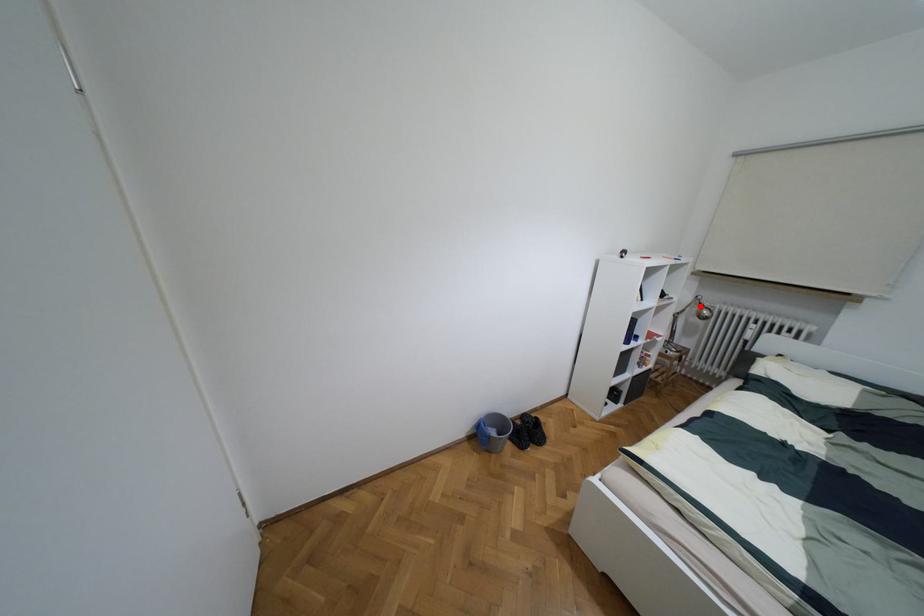
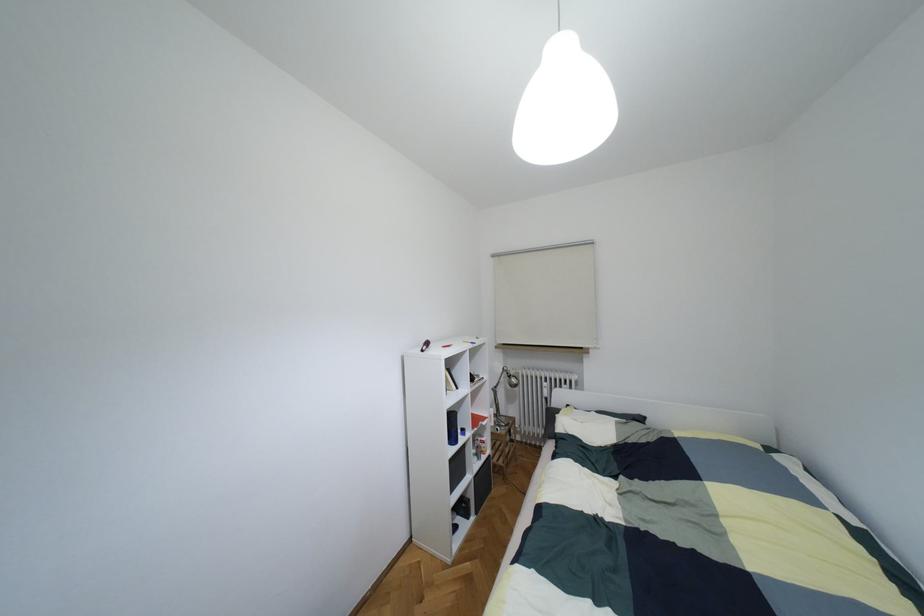
Locate, in the second image, the point that corresponds to the highlighted location in the first image.

(508, 376)